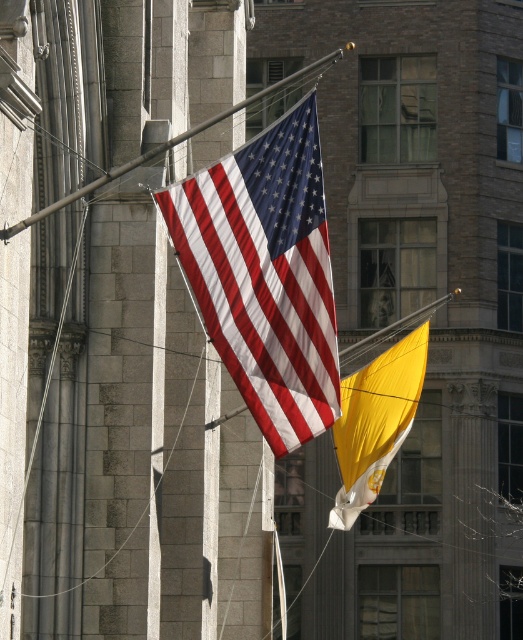
Can you confirm if matte fabric flag at center is shorter than yellow satin flag at center?

In fact, matte fabric flag at center may be taller than yellow satin flag at center.

Does matte fabric flag at center have a greater height compared to yellow satin flag at center?

Yes.

Is point (316, 145) closer to viewer compared to point (347, 465)?

Yes, it is in front of point (347, 465).

Locate an element on the screen. matte fabric flag at center is located at coordinates pos(266,275).